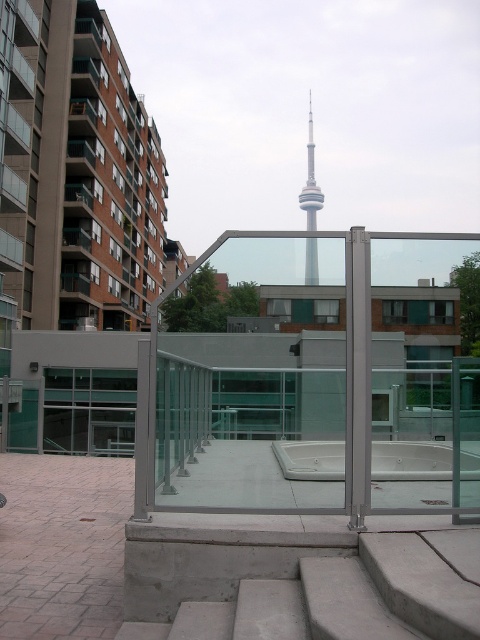
Between transparent glass door at center and white glossy pool at center, which one has more height?

Standing taller between the two is transparent glass door at center.

Where is `transparent glass door at center`? Image resolution: width=480 pixels, height=640 pixels. transparent glass door at center is located at coordinates (315, 376).

Which is in front, point (403, 344) or point (372, 476)?

Positioned in front is point (403, 344).

Image resolution: width=480 pixels, height=640 pixels. Identify the location of transparent glass door at center. (315, 376).

Between point (404, 474) and point (308, 257), which one is positioned behind?

Point (404, 474)

Find the location of `transparent glass door at center`. transparent glass door at center is located at coordinates (315, 376).

Does point (238, 368) come in front of point (314, 256)?

No, (238, 368) is further to viewer.

Locate an element on the screen. The height and width of the screenshot is (640, 480). transparent glass door at center is located at coordinates (315, 376).

Does concrete stairs at lower center have a greater height compared to white glossy pool at center?

Yes, concrete stairs at lower center is taller than white glossy pool at center.

Between point (363, 561) and point (303, 445), which one is positioned behind?

The point (303, 445) is more distant.

Find the location of a particular element. concrete stairs at lower center is located at coordinates (346, 595).

Where is `concrete stairs at lower center`? concrete stairs at lower center is located at coordinates (346, 595).